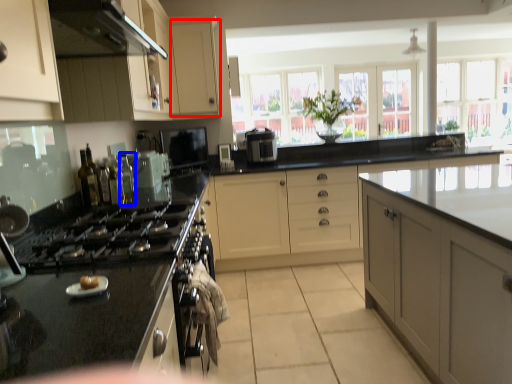
Question: Which point is closer to the camera, cabinetry (highlighted by a red box) or bottle (highlighted by a blue box)?

Choices:
 (A) cabinetry
 (B) bottle

Answer: (B)